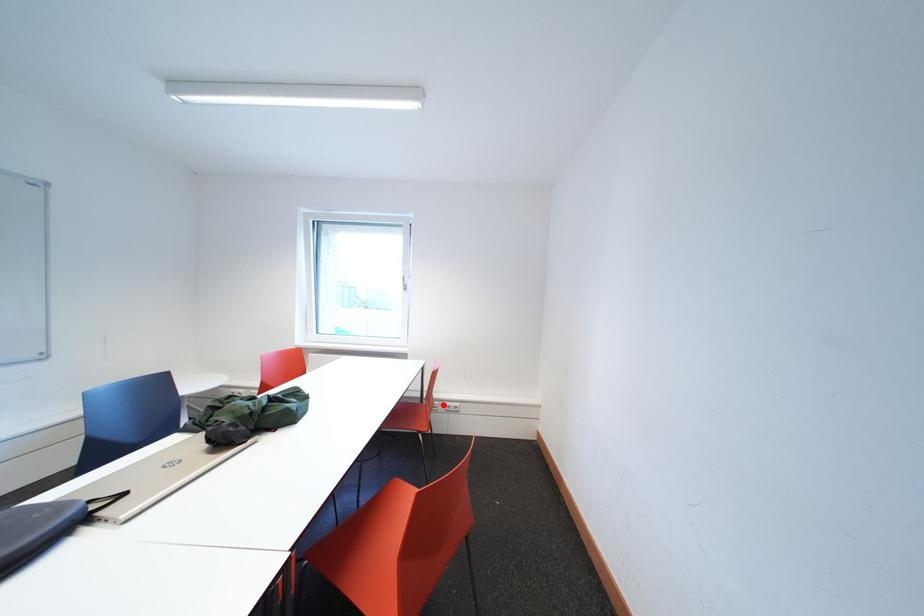
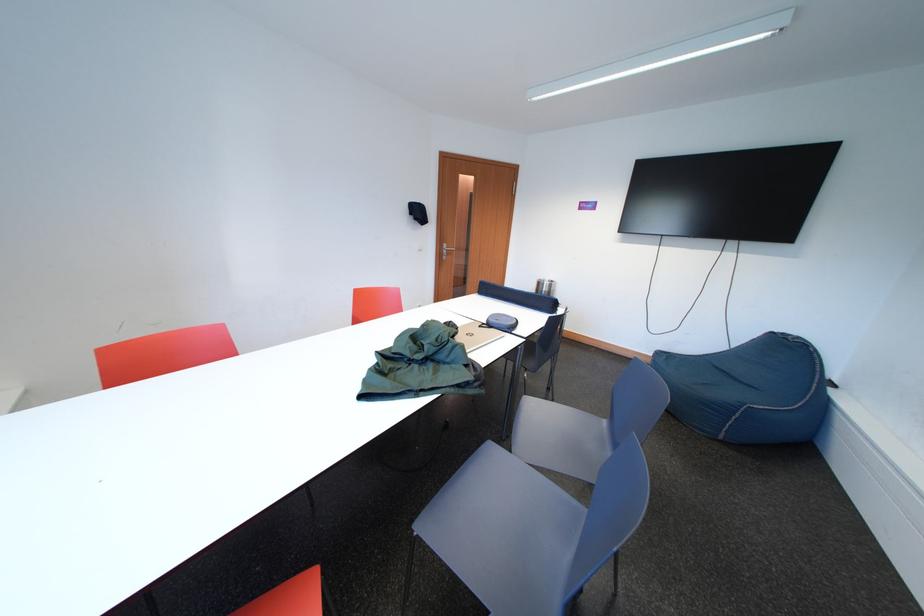
Question: I am providing you with two images of the same scene from different viewpoints. A red point is marked on the first image. Is the red point's position out of view in image 2?

Choices:
 (A) Yes
 (B) No

Answer: (A)